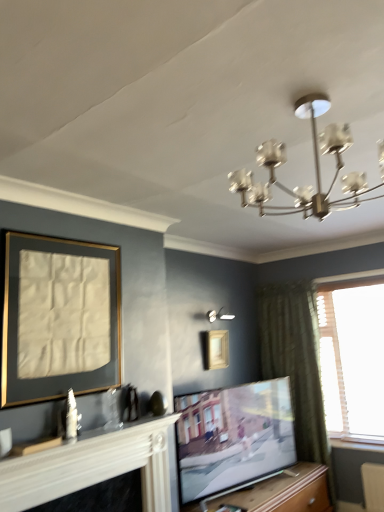
Question: Is wooden at center to the left or to the right of matte black tv at center in the image?

Choices:
 (A) right
 (B) left

Answer: (A)

Question: From a real-world perspective, relative to matte black tv at center, is wooden at center vertically above or below?

Choices:
 (A) above
 (B) below

Answer: (B)

Question: Estimate the real-world distances between objects in this image. Which object is closer to the wooden at center?

Choices:
 (A) white painted wood fireplace at lower left
 (B) matte gold picture frame at left, which is the first picture frame in top-to-bottom order
 (C) white glossy wall sconce at upper center
 (D) matte black tv at center
 (E) wooden picture frame at upper center, positioned as the 2th picture frame in top-to-bottom order

Answer: (D)

Question: Considering the real-world distances, which object is farthest from the white painted wood fireplace at lower left?

Choices:
 (A) matte black tv at center
 (B) wooden at center
 (C) wooden picture frame at upper center, placed as the 1th picture frame when sorted from right to left
 (D) white glossy wall sconce at upper center
 (E) matte gold picture frame at left, positioned as the second picture frame in back-to-front order

Answer: (D)